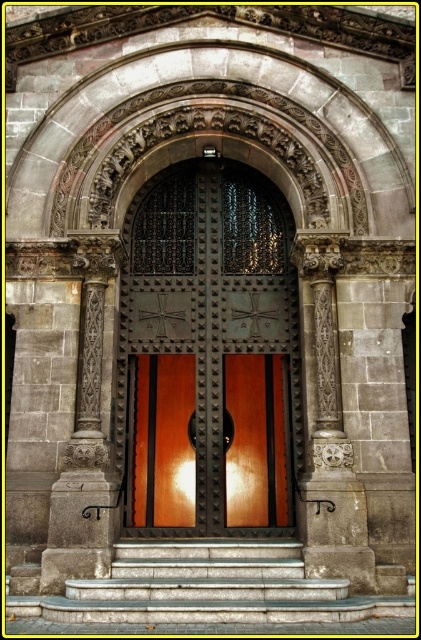
Question: Estimate the real-world distances between objects in this image. Which object is farther from the polished wood door at center?

Choices:
 (A) carved stone column at center
 (B) glossy wood door at center
 (C) smooth stone steps at center

Answer: (C)

Question: Can you confirm if carved stone column at center is positioned below carved stone column at left?

Choices:
 (A) no
 (B) yes

Answer: (A)

Question: Which point is closer to the camera?

Choices:
 (A) (269, 225)
 (B) (69, 509)
 (C) (186, 390)
 (D) (159, 548)

Answer: (B)

Question: Which point is closer to the camera?

Choices:
 (A) (226, 600)
 (B) (175, 412)
 (C) (192, 396)

Answer: (A)

Question: Is glossy wood door at center positioned at the back of carved stone column at left?

Choices:
 (A) yes
 (B) no

Answer: (A)

Question: Can you confirm if smooth stone steps at center is smaller than glossy wood door at center?

Choices:
 (A) yes
 (B) no

Answer: (A)